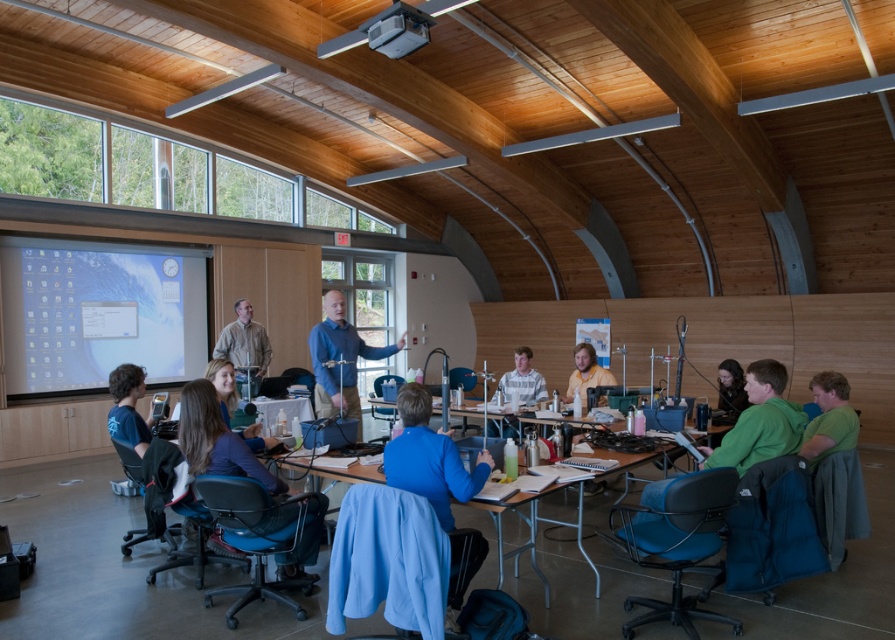
Question: Is green matte shirt at lower right closer to the viewer compared to dark blue t-shirt at lower left?

Choices:
 (A) no
 (B) yes

Answer: (B)

Question: Which point is farther from the camera taking this photo?

Choices:
 (A) (847, 381)
 (B) (527, 374)

Answer: (B)

Question: Considering the relative positions of blue fabric at center and blue shirt at center in the image provided, where is blue fabric at center located with respect to blue shirt at center?

Choices:
 (A) right
 (B) left

Answer: (A)

Question: Is green fleece jacket at lower right above dark brown hair at center?

Choices:
 (A) no
 (B) yes

Answer: (A)

Question: Among these points, which one is nearest to the camera?

Choices:
 (A) (135, 435)
 (B) (246, 360)

Answer: (A)

Question: Which of these objects is positioned closest to the light brown hair at center?

Choices:
 (A) green matte shirt at lower right
 (B) green fleece jacket at lower right
 (C) wooden table at center

Answer: (C)